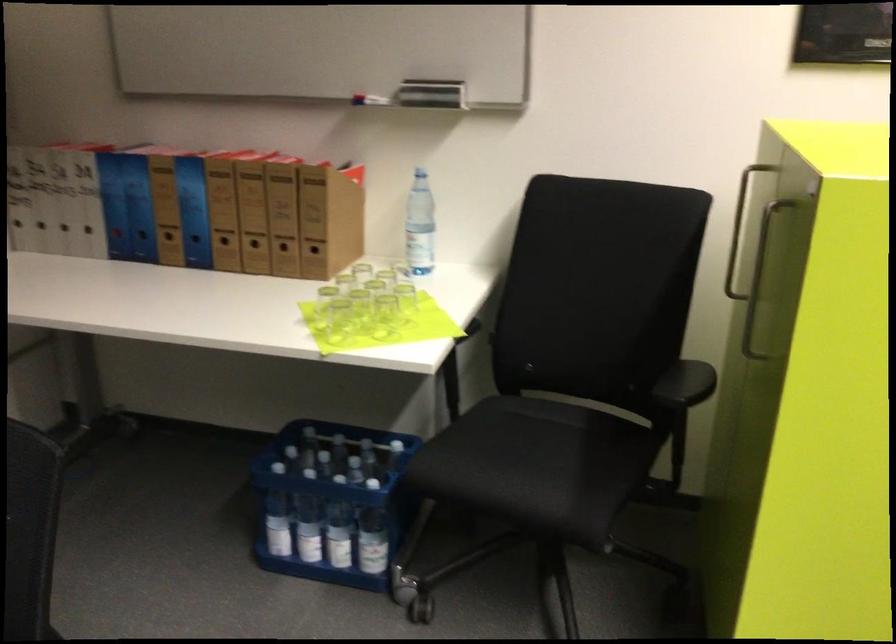
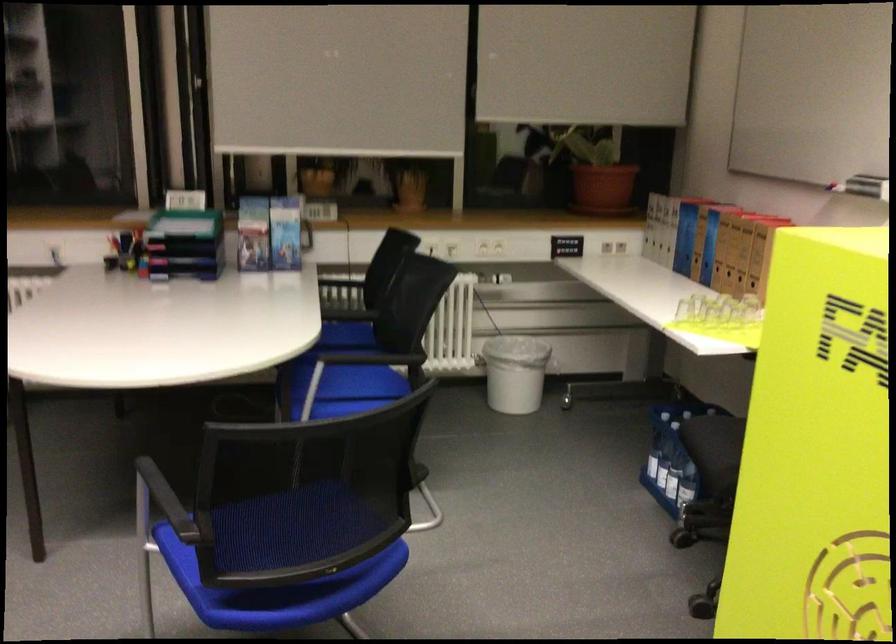
The point at (282, 529) is marked in the first image. Where is the corresponding point in the second image?

(650, 458)